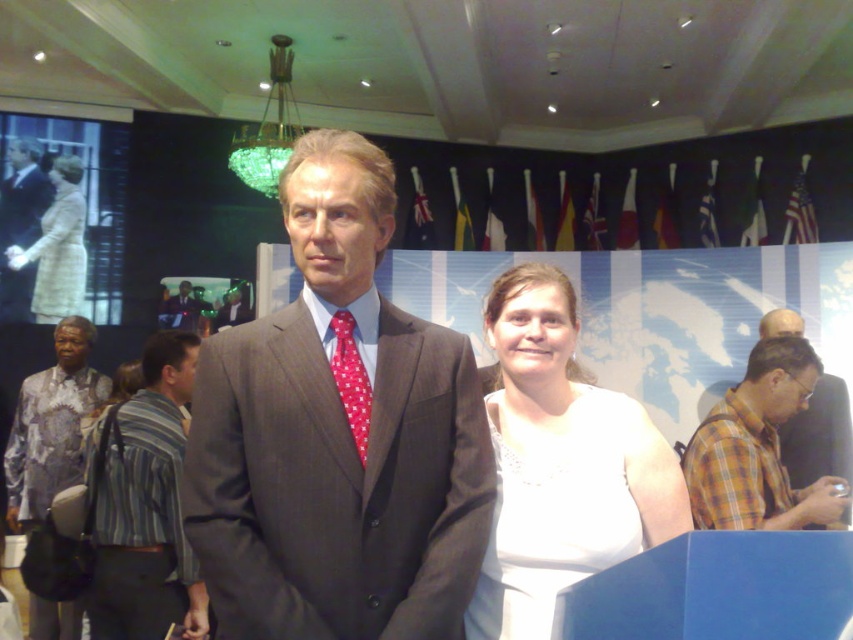
Question: Estimate the real-world distances between objects in this image. Which object is closer to the red dotted fabric tie at center?

Choices:
 (A) white satin dress at center
 (B) plaid shirt at right
 (C) light beige wool coat at left
 (D) striped cotton shirt at left

Answer: (A)

Question: Does matte brown suit at center have a lesser width compared to dark brown suit at center?

Choices:
 (A) yes
 (B) no

Answer: (B)

Question: Which of the following is the farthest from the observer?

Choices:
 (A) (39, 291)
 (B) (772, 456)
 (C) (73, 454)
 (D) (343, 353)

Answer: (A)

Question: Is printed silk shirt at left wider than dark brown suit at center?

Choices:
 (A) no
 (B) yes

Answer: (B)

Question: Among these points, which one is nearest to the camera?

Choices:
 (A) (231, 314)
 (B) (368, 403)
 (C) (22, 497)
 (D) (311, 605)

Answer: (D)

Question: In this image, where is plaid shirt at right located relative to printed silk shirt at left?

Choices:
 (A) left
 (B) right

Answer: (B)